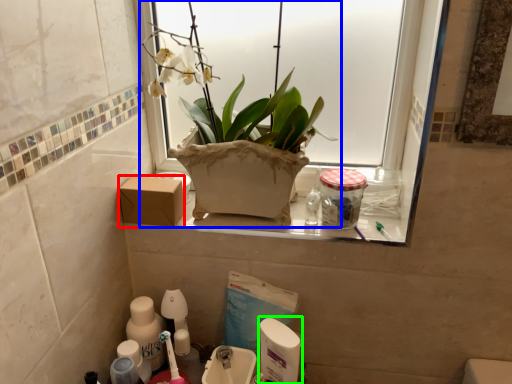
Question: Considering the real-world distances, which object is closest to cardboard box (highlighted by a red box)? houseplant (highlighted by a blue box) or cleaning product (highlighted by a green box).

Choices:
 (A) houseplant
 (B) cleaning product

Answer: (A)